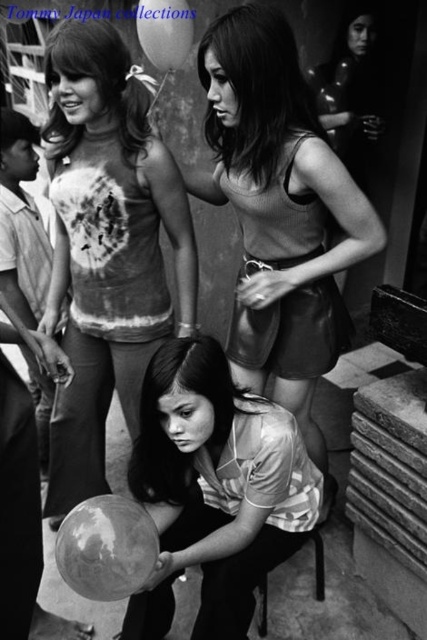
You are a photographer trying to capture a closeup of the striped fabric blouse at center without the metallic black chair at lower center blocking the view. Is it possible to do so from your current position?

The striped fabric blouse at center is in front of the metallic black chair at lower center, so yes, you can take a closeup of the striped fabric blouse at center without the chair blocking the view since it is positioned in front.